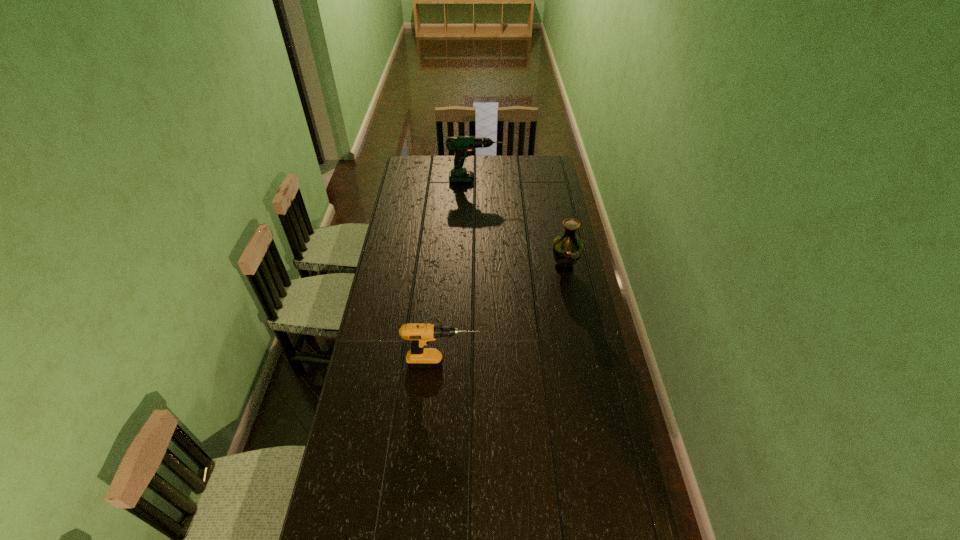
You are a GUI agent. You are given a task and a screenshot of the screen. Output one action in this format:
    pyautogui.click(x=<x>, y=<y>)
    Task: Click on the free region at the far edge of the desktop
    The width and height of the screenshot is (960, 540).
    Given the screenshot: What is the action you would take?
    pyautogui.click(x=494, y=169)

This screenshot has width=960, height=540. Identify the location of free space at the left edge of the desktop. (424, 208).

Locate an element on the screen. The height and width of the screenshot is (540, 960). vacant area at the right edge of the desktop is located at coordinates (580, 274).

Identify the location of vacant space at the far left corner of the desktop. The width and height of the screenshot is (960, 540). (412, 159).

What are the coordinates of `free space between the nearest object and the farther drill` in the screenshot? It's located at (459, 272).

I want to click on free space that is in between the taller drill and the second nearest object, so click(519, 224).

Identify the location of free space between the taller drill and the nearest object. The width and height of the screenshot is (960, 540). (459, 272).

The image size is (960, 540). Find the location of `empty location between the taller drill and the shorter drill`. empty location between the taller drill and the shorter drill is located at coordinates (459, 272).

I want to click on unoccupied area between the rightmost object and the shorter drill, so click(x=503, y=315).

Find the location of a particular element. Image resolution: width=960 pixels, height=540 pixels. object that stands as the closest to the taller drill is located at coordinates (567, 248).